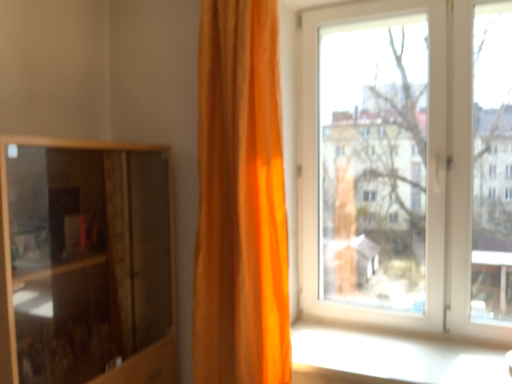
At what (x,y) coordinates should I click in order to perform the action: click on vacant space in front of white plastic window at upper right. Please return your answer as a coordinate pair (x, y). Image resolution: width=512 pixels, height=384 pixels. Looking at the image, I should click on (422, 365).